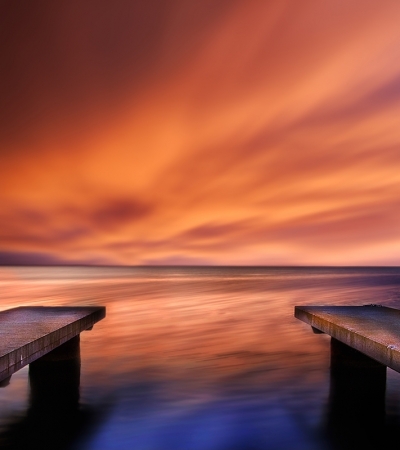
Identify the location of painting. (192, 337).